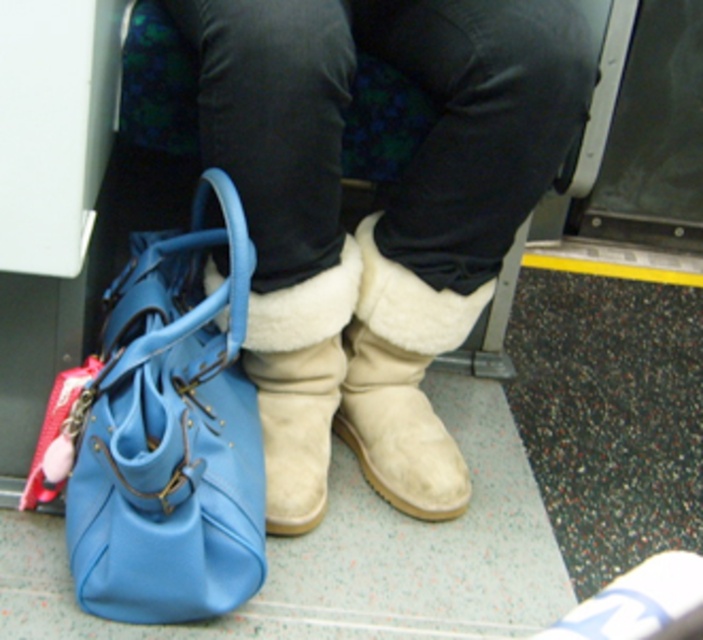
Does suede boots at center have a greater width compared to blue leather handbag at lower left?

Indeed, suede boots at center has a greater width compared to blue leather handbag at lower left.

Can you confirm if suede boots at center is positioned to the left of blue leather handbag at lower left?

In fact, suede boots at center is to the right of blue leather handbag at lower left.

Who is more distant from viewer, (404, 352) or (219, 486)?

The point (404, 352) is more distant.

Locate an element on the screen. suede boots at center is located at coordinates (375, 216).

Between blue leather handbag at lower left and white suede boot at center, which one is positioned lower?

blue leather handbag at lower left

Does blue leather handbag at lower left appear over white suede boot at center?

Incorrect, blue leather handbag at lower left is not positioned above white suede boot at center.

Does point (79, 460) come closer to viewer compared to point (352, 355)?

Yes.

Find the location of a particular element. This screenshot has height=640, width=703. blue leather handbag at lower left is located at coordinates (169, 435).

Does suede boots at center come behind white suede boot at center?

No, suede boots at center is in front of white suede boot at center.

Is suede boots at center thinner than white suede boot at center?

In fact, suede boots at center might be wider than white suede boot at center.

This screenshot has width=703, height=640. What do you see at coordinates (375, 216) in the screenshot? I see `suede boots at center` at bounding box center [375, 216].

I want to click on suede boots at center, so click(375, 216).